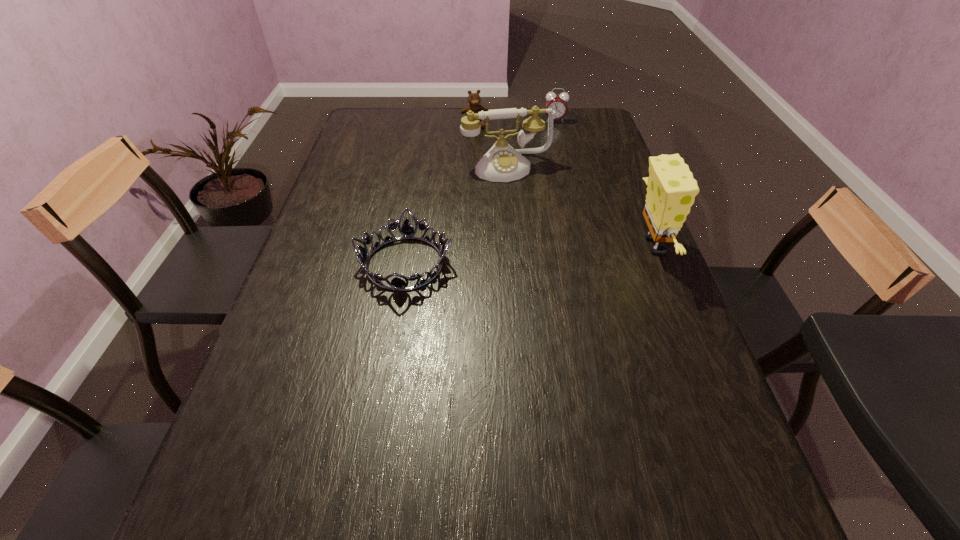
Where is `vacant spot on the desktop that is between the shortest object and the sponge and is positioned at the face of the teddy bear`? vacant spot on the desktop that is between the shortest object and the sponge and is positioned at the face of the teddy bear is located at coordinates (520, 255).

Image resolution: width=960 pixels, height=540 pixels. In order to click on vacant space on the desktop that is between the tiara and the rightmost object and is positioned on the dial of the telephone in this screenshot , I will do (538, 254).

Image resolution: width=960 pixels, height=540 pixels. Find the location of `vacant space on the desktop that is between the tiara and the rightmost object and is positioned on the clock face of the alarm clock`. vacant space on the desktop that is between the tiara and the rightmost object and is positioned on the clock face of the alarm clock is located at coordinates (563, 252).